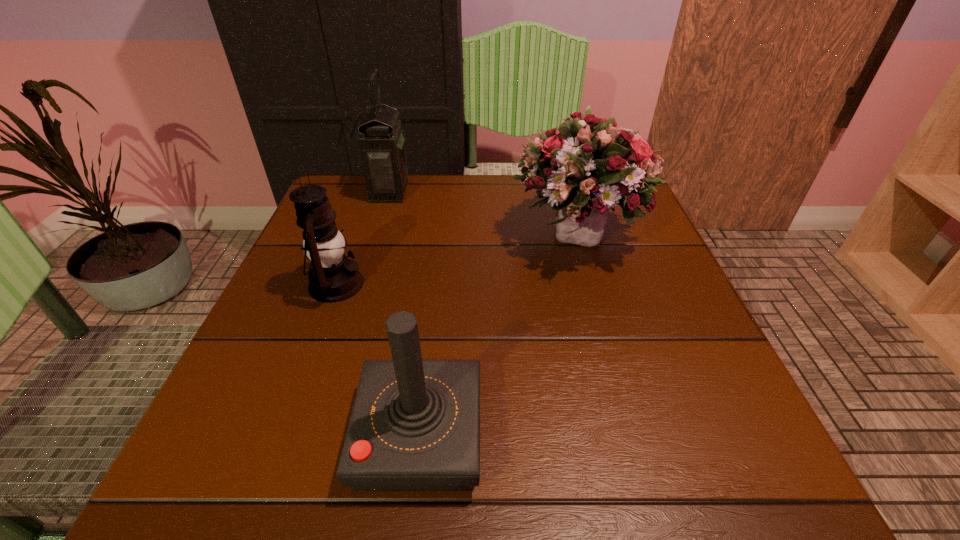
In order to click on vacant position in the image that satisfies the following two spatial constraints: 1. on the front-facing side of the rightmost object; 2. on the left side of the farther lantern in this screenshot , I will do `click(375, 238)`.

The height and width of the screenshot is (540, 960). Find the location of `free space that satisfies the following two spatial constraints: 1. on the back side of the rightmost object; 2. on the front-facing side of the farther lantern`. free space that satisfies the following two spatial constraints: 1. on the back side of the rightmost object; 2. on the front-facing side of the farther lantern is located at coordinates (565, 191).

Find the location of a particular element. free location that satisfies the following two spatial constraints: 1. on the back side of the bouquet; 2. on the front-facing side of the farther lantern is located at coordinates (565, 191).

Image resolution: width=960 pixels, height=540 pixels. What are the coordinates of `free location that satisfies the following two spatial constraints: 1. on the front-facing side of the farther lantern; 2. on the right side of the bouquet` in the screenshot? It's located at (375, 238).

Locate an element on the screen. This screenshot has width=960, height=540. vacant space that satisfies the following two spatial constraints: 1. on the front-facing side of the farther lantern; 2. on the left side of the bouquet is located at coordinates (375, 238).

The image size is (960, 540). I want to click on vacant point that satisfies the following two spatial constraints: 1. on the front side of the rightmost object; 2. on the side of the nearer lantern, there is a wick adjustment knob, so click(x=592, y=284).